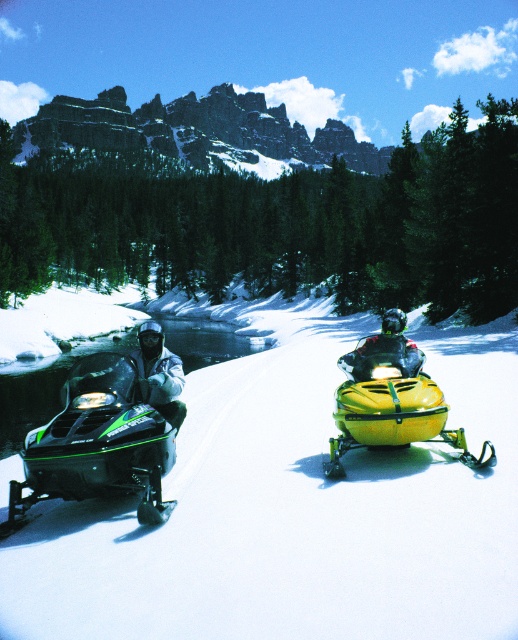
Question: Which is farther from the green matte snowmobile at left?

Choices:
 (A) green plastic snowmobile at center
 (B) white matte jacket at left

Answer: (A)

Question: Is green plastic snowmobile at center to the right of green matte snowmobile at left from the viewer's perspective?

Choices:
 (A) yes
 (B) no

Answer: (A)

Question: Which point appears closest to the camera in this image?

Choices:
 (A) (435, 387)
 (B) (137, 467)

Answer: (B)

Question: Which point is closer to the camera?

Choices:
 (A) (435, 397)
 (B) (358, 355)
 (C) (167, 376)

Answer: (A)

Question: Is green plastic snowmobile at center above yellow plastic snowmobile at center?

Choices:
 (A) no
 (B) yes

Answer: (A)

Question: From the image, what is the correct spatial relationship of green plastic snowmobile at center in relation to yellow plastic snowmobile at center?

Choices:
 (A) below
 (B) above

Answer: (A)